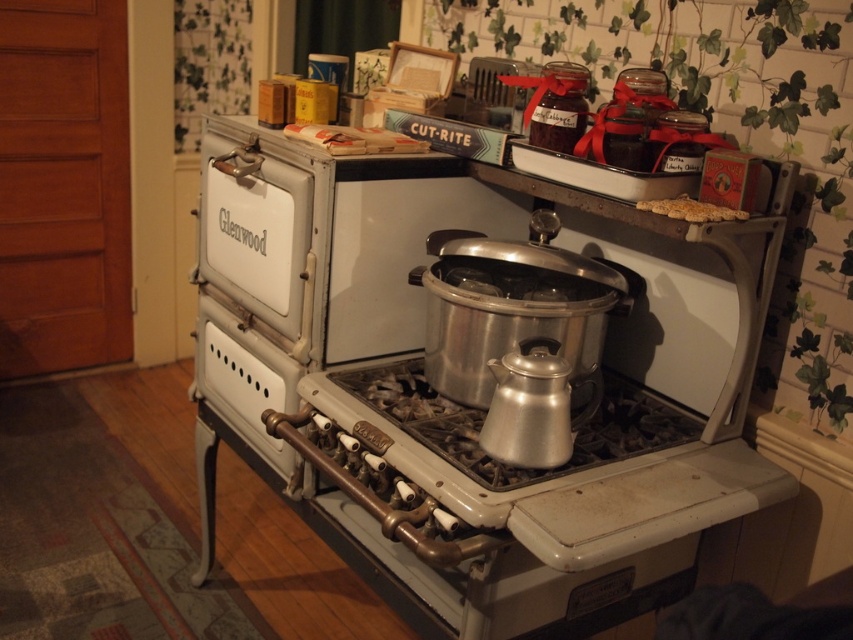
Question: Can you confirm if silver metallic oven at center is positioned below brown crumbly bread at upper center?

Choices:
 (A) yes
 (B) no

Answer: (A)

Question: Which of the following is the closest to the observer?

Choices:
 (A) brown crumbly bread at upper center
 (B) silver metallic oven at center

Answer: (B)

Question: From the image, what is the correct spatial relationship of silver metallic oven at center in relation to brown crumbly bread at upper center?

Choices:
 (A) right
 (B) left

Answer: (B)

Question: Does silver metallic oven at center appear on the right side of brown crumbly bread at upper center?

Choices:
 (A) no
 (B) yes

Answer: (A)

Question: Which of the following is the farthest from the observer?

Choices:
 (A) silver metallic oven at center
 (B) brown crumbly bread at upper center

Answer: (B)

Question: Among these points, which one is farthest from the camera?

Choices:
 (A) (711, 216)
 (B) (230, 436)

Answer: (B)